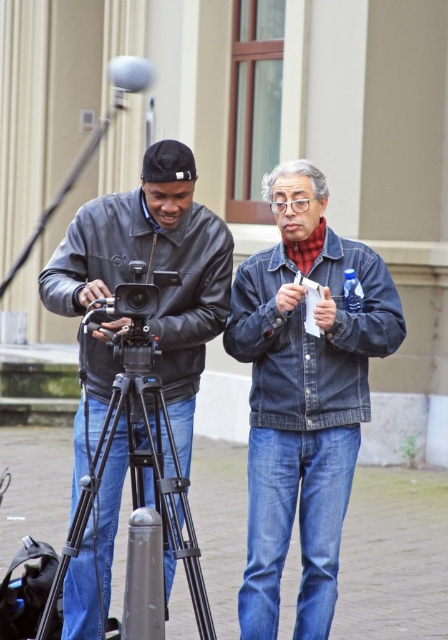
You are standing at the origin of the coordinate system in the scene. There is a point at coordinates point [304,396]. What object is located at that point?

The point [304,396] corresponds to the denim jacket at center.

You are a costume designer observing the two jackets in the scene. Which jacket is taller when comparing the denim jacket at center and the black leather jacket at left?

The denim jacket at center is taller than the black leather jacket at left.

You are a costume designer observing the video production scene. You need to determine which jacket is positioned higher in the image. Which one is higher between the denim jacket at center and the black leather jacket at left?

The denim jacket at center is located above the black leather jacket at left, so the denim jacket at center is higher in the image.